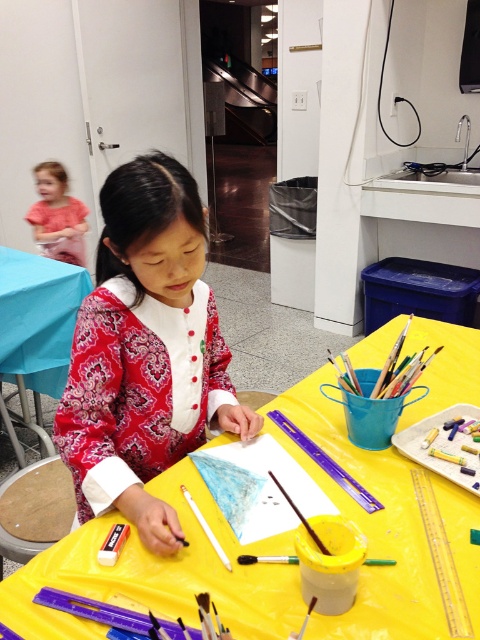
You are an art teacher observing the young girl at the yellow plastic table at center and the matte red dress at center. Which object is bigger in size?

The yellow plastic table at center is larger in size compared to the matte red dress at center.

You are a teacher in the classroom. You need to place a 4 feet long ruler between the matte blue table at center and the matte pink shirt at upper left. Is there enough space?

The distance between the matte blue table at center and the matte pink shirt at upper left is 3.54 feet. Since the ruler is 4 feet long, it would not fit in the available space.